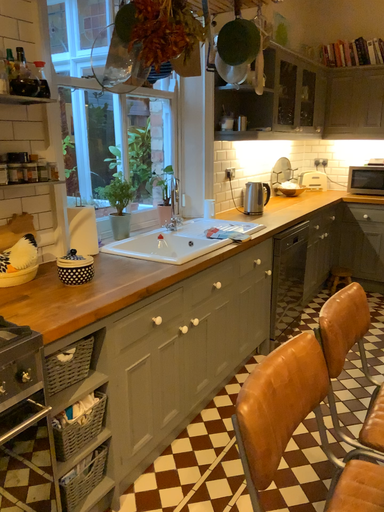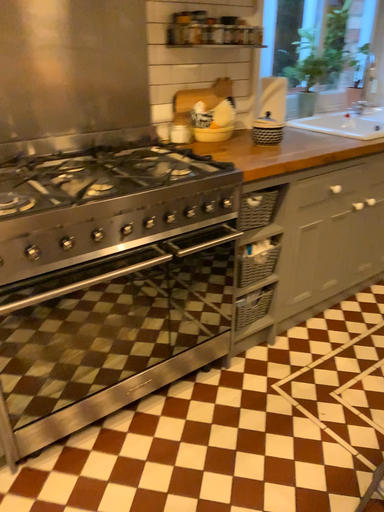
Question: Which way did the camera rotate in the video?

Choices:
 (A) rotated right
 (B) rotated left

Answer: (B)